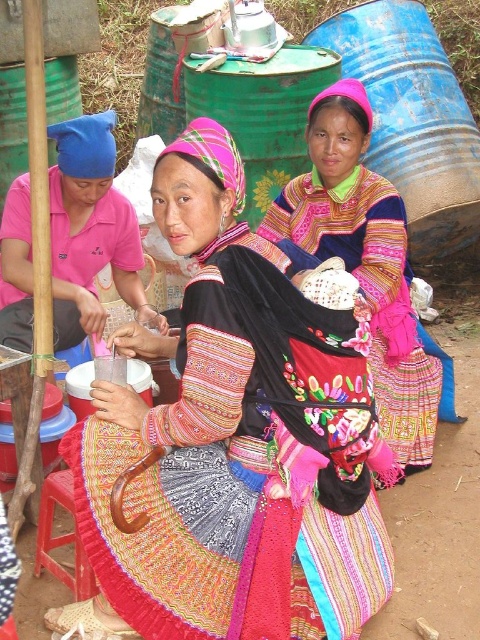
How much distance is there between embroidered fabric dress at center and pink fabric dress at left?

35.97 inches

Does point (291, 204) come farther from viewer compared to point (67, 282)?

Yes, it is.

What do you see at coordinates (364, 260) in the screenshot? The image size is (480, 640). I see `embroidered fabric dress at center` at bounding box center [364, 260].

Locate an element on the screen. Image resolution: width=480 pixels, height=640 pixels. embroidered fabric dress at center is located at coordinates (364, 260).

How much distance is there between pink fabric dress at left and wooden stool at lower left?

A distance of 3.31 feet exists between pink fabric dress at left and wooden stool at lower left.

This screenshot has height=640, width=480. Describe the element at coordinates (87, 250) in the screenshot. I see `pink fabric dress at left` at that location.

Does point (63, 282) come farther from viewer compared to point (61, 541)?

Yes.

What are the coordinates of `pink fabric dress at left` in the screenshot? It's located at (87, 250).

Does embroidered fabric dress at center appear on the right side of wooden stool at lower left?

Indeed, embroidered fabric dress at center is positioned on the right side of wooden stool at lower left.

Which is above, embroidered fabric dress at center or wooden stool at lower left?

embroidered fabric dress at center is above.

This screenshot has height=640, width=480. What do you see at coordinates (364, 260) in the screenshot? I see `embroidered fabric dress at center` at bounding box center [364, 260].

You are a GUI agent. You are given a task and a screenshot of the screen. Output one action in this format:
    pyautogui.click(x=<x>, y=<y>)
    Task: Click on the embroidered fabric dress at center
    
    Given the screenshot: What is the action you would take?
    pyautogui.click(x=364, y=260)